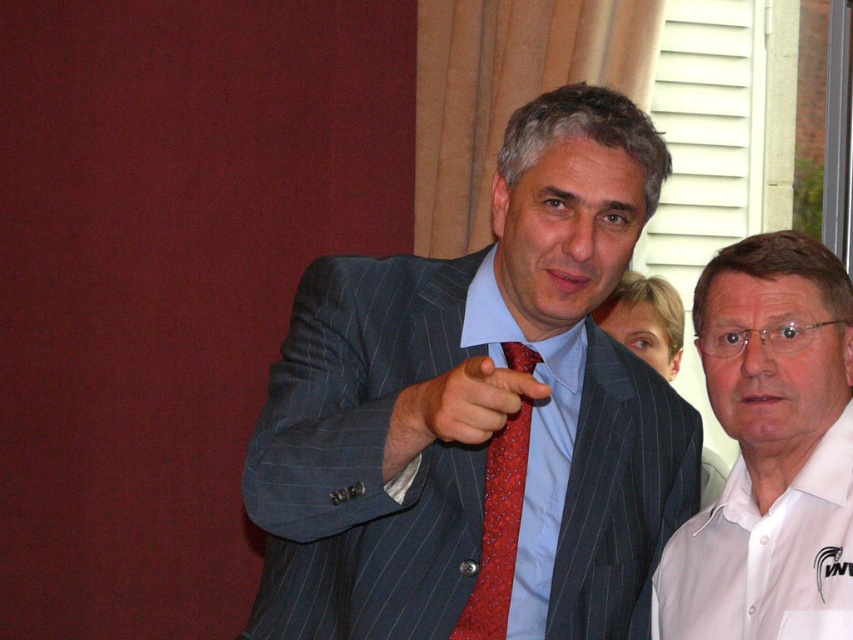
Who is positioned more to the left, pinstriped suit at center or red dotted tie at center?

Positioned to the left is red dotted tie at center.

Is point (572, 620) behind point (471, 394)?

Yes, point (572, 620) is behind point (471, 394).

The height and width of the screenshot is (640, 853). What are the coordinates of `pinstriped suit at center` in the screenshot? It's located at (492, 435).

Who is taller, white cotton polo shirt at lower right or red dotted fabric tie at center?

Standing taller between the two is red dotted fabric tie at center.

Which is in front, point (722, 592) or point (486, 579)?

Positioned in front is point (722, 592).

Where is `white cotton polo shirt at lower right`? The height and width of the screenshot is (640, 853). white cotton polo shirt at lower right is located at coordinates (764, 556).

Is point (381, 518) positioned after point (653, 618)?

No, (381, 518) is closer to viewer.

Between point (531, 616) and point (727, 618), which one is positioned in front?

Point (727, 618)

What are the coordinates of `pinstriped suit at center` in the screenshot? It's located at tap(492, 435).

Identify the location of pinstriped suit at center. This screenshot has height=640, width=853. (492, 435).